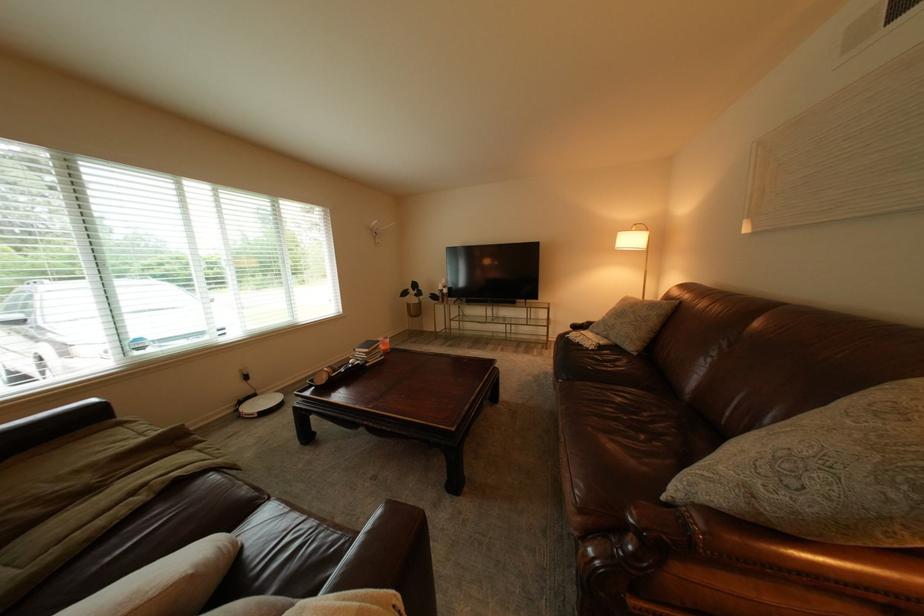
The location [824,471] corresponds to which object?

It corresponds to the patterned throw pillow in the image.